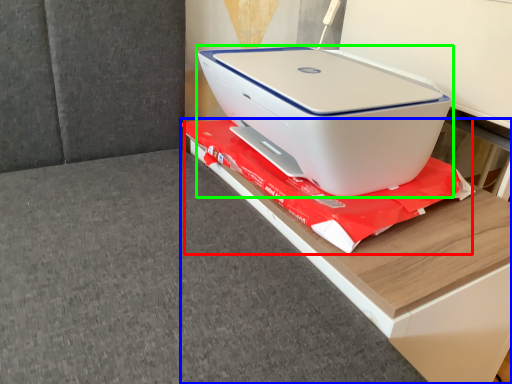
Question: Which is farther away from material (highlighted by a red box)? furniture (highlighted by a blue box) or printer (highlighted by a green box)?

Choices:
 (A) furniture
 (B) printer

Answer: (B)